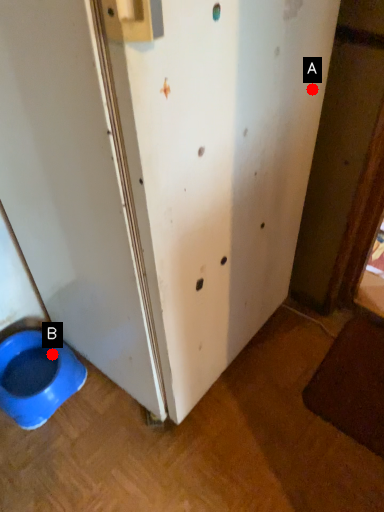
Question: Two points are circled on the image, labeled by A and B beside each circle. Which point is closer to the camera taking this photo?

Choices:
 (A) A is closer
 (B) B is closer

Answer: (A)